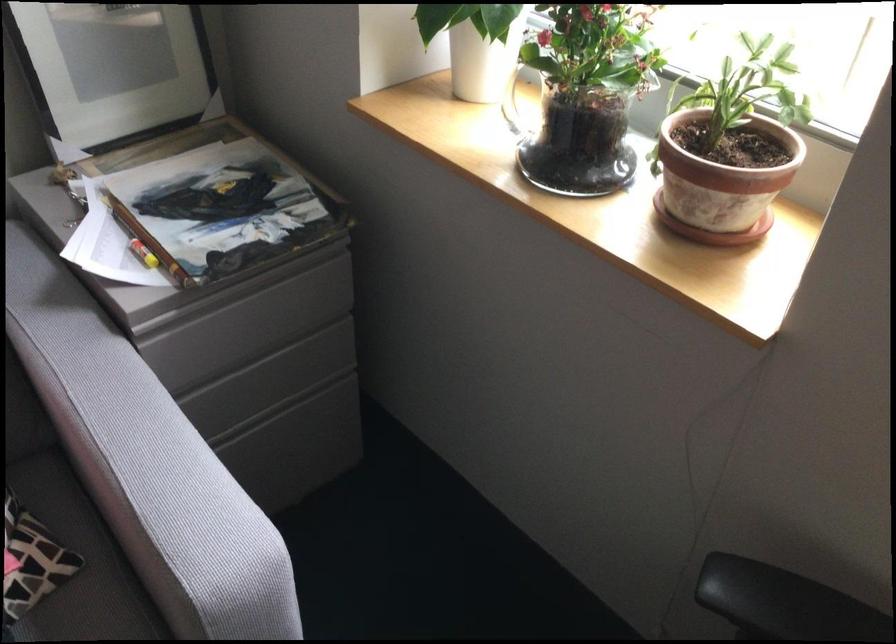
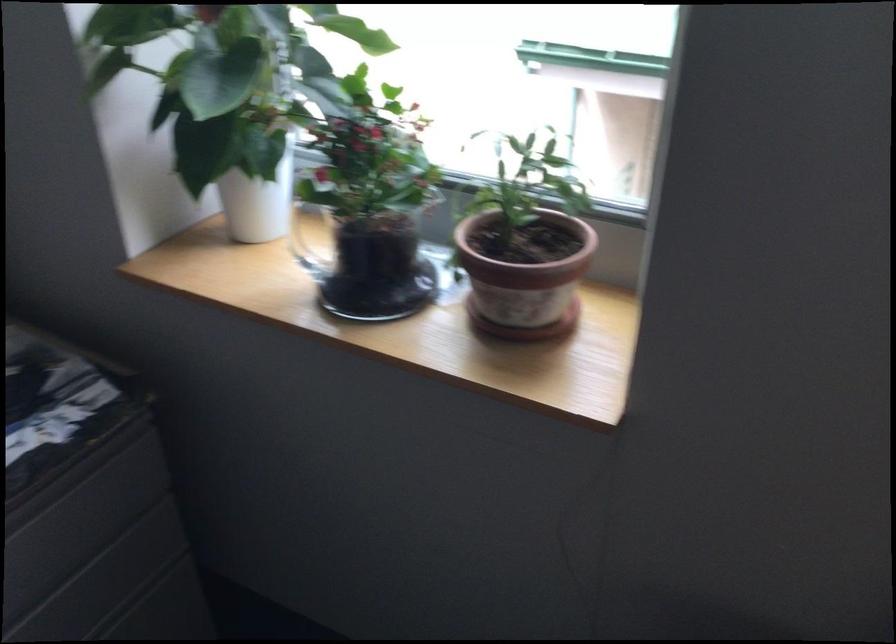
Question: The first image is from the beginning of the video and the second image is from the end. How did the camera likely rotate when shooting the video?

Choices:
 (A) Left
 (B) Right
 (C) Up
 (D) Down

Answer: (B)